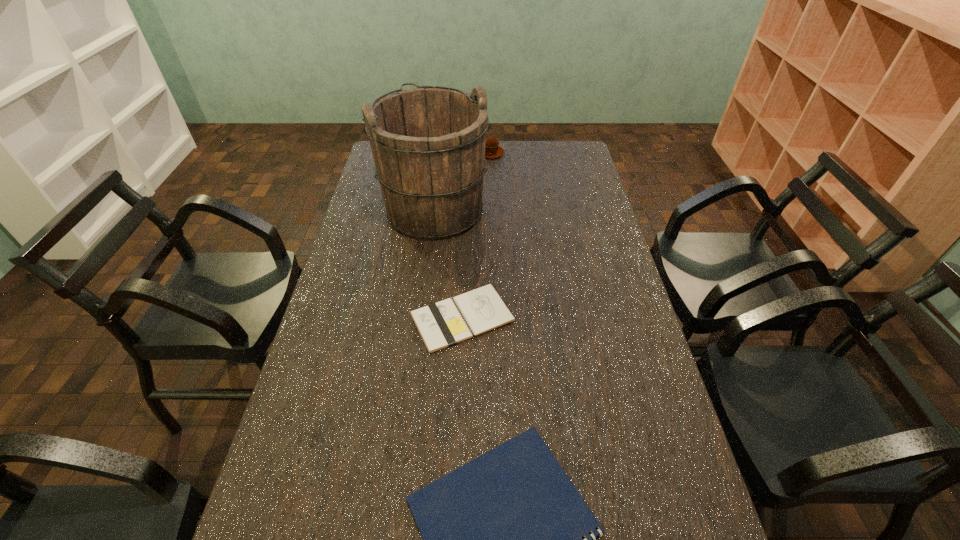
This screenshot has width=960, height=540. In order to click on the tallest object in this screenshot , I will do pyautogui.click(x=428, y=143).

Find the location of a particular element. This screenshot has width=960, height=540. the third nearest object is located at coordinates (428, 143).

At what (x,y) coordinates should I click in order to perform the action: click on muffin. Please return your answer as a coordinate pair (x, y). This screenshot has width=960, height=540. Looking at the image, I should click on (493, 150).

The image size is (960, 540). I want to click on the second tallest object, so [493, 150].

Locate an element on the screen. This screenshot has width=960, height=540. the farther notepad is located at coordinates (441, 325).

Image resolution: width=960 pixels, height=540 pixels. What are the coordinates of `vacant space located on the right of the second farthest object` in the screenshot? It's located at (506, 209).

Image resolution: width=960 pixels, height=540 pixels. I want to click on free location located 0.110m on the left of the muffin, so click(452, 153).

Locate an element on the screen. Image resolution: width=960 pixels, height=540 pixels. vacant region located on the front of the farther notepad is located at coordinates (457, 474).

Find the location of a particular element. The width and height of the screenshot is (960, 540). object located at the far edge is located at coordinates (493, 150).

Find the location of `object at the left edge`. object at the left edge is located at coordinates (428, 143).